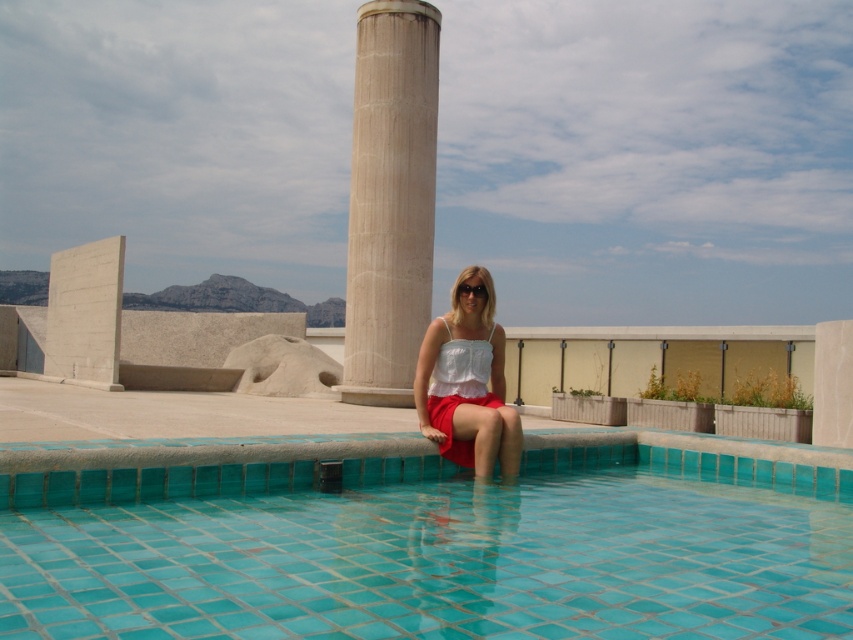
You are standing at the edge of the swimming pool and want to take a photo of the beige marble pillar at center. Where should you position yourself to capture it in the frame?

To capture the beige marble pillar at center in your photo, position yourself at the edge of the swimming pool facing towards the pillar located at point (390, 198).

You are a photographer trying to capture the scene of the turquoise tile swimming pool at lower center and the matte black sunglasses at center. Which object should you focus on first if you want to ensure both are in sharp focus?

The photographer should focus on the matte black sunglasses at center first because the turquoise tile swimming pool at lower center is farther away. By focusing on the closer object, the depth of field may include the farther object as well.

You are a photographer trying to capture the two points in the scene. Which point, point (374, 470) or point (462, 284), would appear larger in your photo?

Point (374, 470) is closer to the camera than point (462, 284), so it would appear larger in the photo.